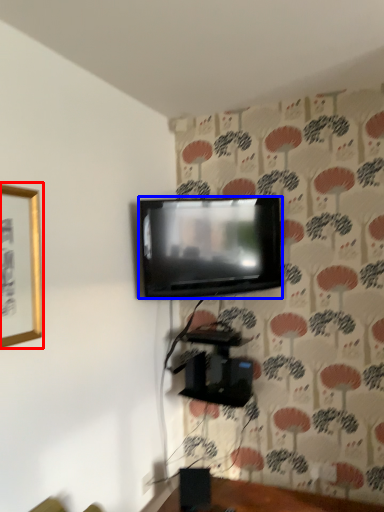
Question: Which object is further to the camera taking this photo, picture frame (highlighted by a red box) or television (highlighted by a blue box)?

Choices:
 (A) picture frame
 (B) television

Answer: (B)